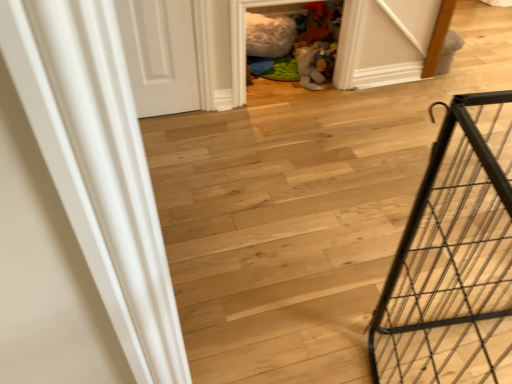
Question: Would you say wooden floor at center contains white matte door at upper left?

Choices:
 (A) yes
 (B) no

Answer: (B)

Question: Does wooden floor at center appear on the right side of white matte door at upper left?

Choices:
 (A) no
 (B) yes

Answer: (B)

Question: Does wooden floor at center touch white matte door at upper left?

Choices:
 (A) yes
 (B) no

Answer: (B)

Question: Is wooden floor at center positioned with its back to white matte door at upper left?

Choices:
 (A) no
 (B) yes

Answer: (A)

Question: From the image's perspective, is wooden floor at center under white matte door at upper left?

Choices:
 (A) yes
 (B) no

Answer: (A)

Question: Can you confirm if wooden floor at center is taller than white matte door at upper left?

Choices:
 (A) yes
 (B) no

Answer: (B)

Question: Does white matte door at upper left have a greater width compared to wooden floor at center?

Choices:
 (A) yes
 (B) no

Answer: (B)

Question: Would you say wooden floor at center is part of white matte door at upper left's contents?

Choices:
 (A) no
 (B) yes

Answer: (A)

Question: Is white matte door at upper left facing away from wooden floor at center?

Choices:
 (A) yes
 (B) no

Answer: (B)

Question: Is white matte door at upper left positioned before wooden floor at center?

Choices:
 (A) yes
 (B) no

Answer: (B)

Question: Could you tell me if white matte door at upper left is turned towards wooden floor at center?

Choices:
 (A) yes
 (B) no

Answer: (B)

Question: Considering the relative sizes of white matte door at upper left and wooden floor at center in the image provided, is white matte door at upper left bigger than wooden floor at center?

Choices:
 (A) no
 (B) yes

Answer: (A)

Question: Is wooden floor at center bigger than black metal cage at right?

Choices:
 (A) yes
 (B) no

Answer: (A)